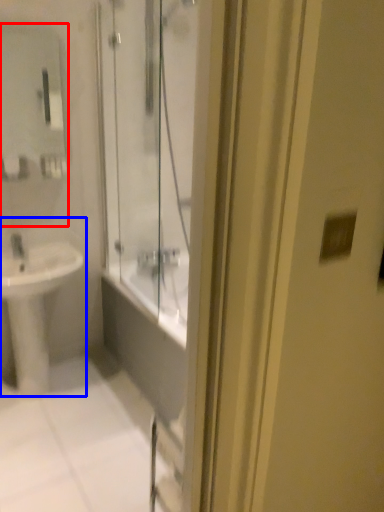
Question: Which point is closer to the camera, mirror (highlighted by a red box) or sink (highlighted by a blue box)?

Choices:
 (A) mirror
 (B) sink

Answer: (B)